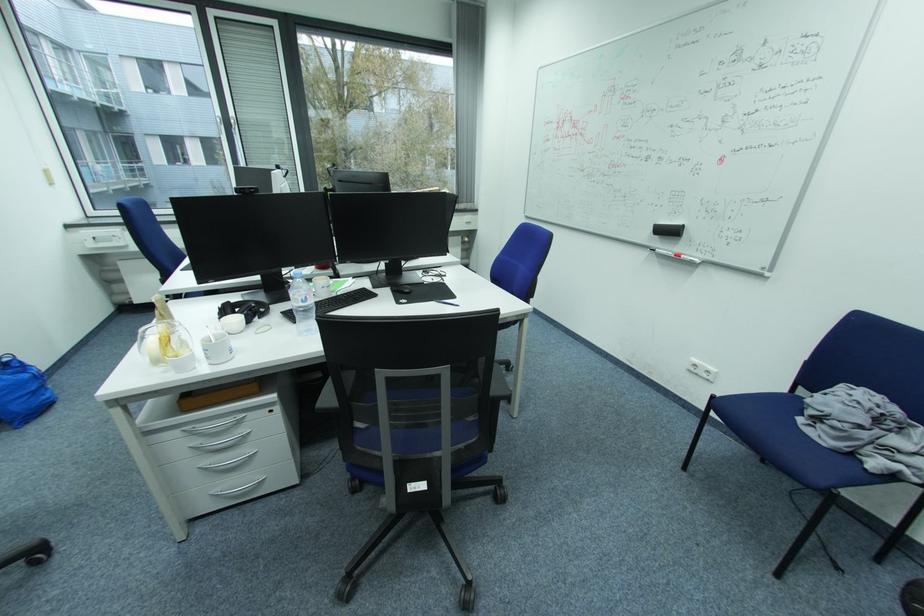
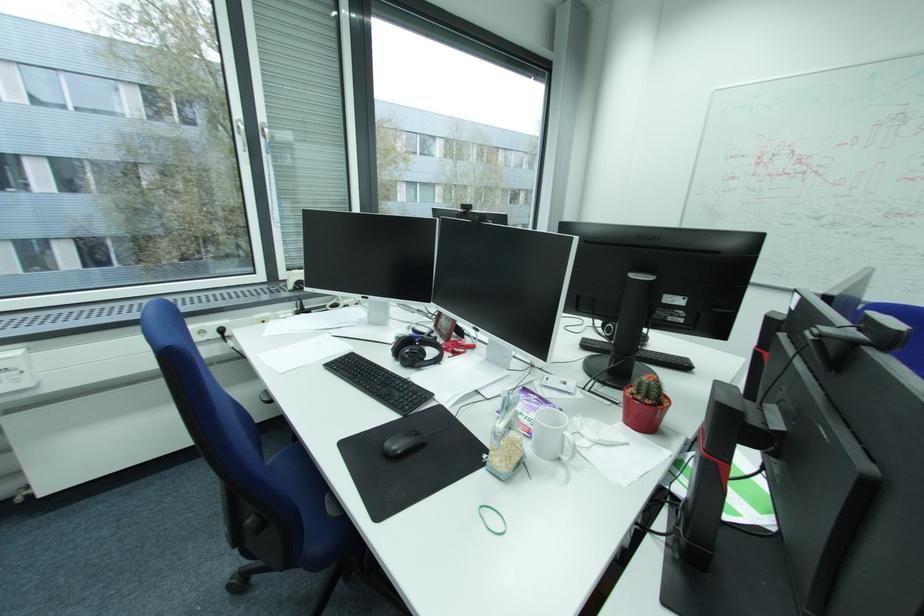
From the picture: In a continuous first-person perspective shot, in which direction is the camera moving?

The cameraman moved toward left, forward.